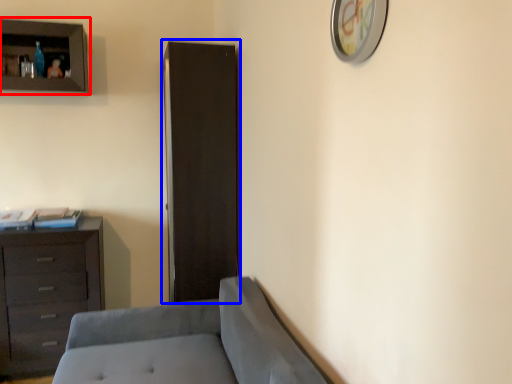
Question: Which of the following is the farthest to the observer, cupboard (highlighted by a red box) or file cabinet (highlighted by a blue box)?

Choices:
 (A) cupboard
 (B) file cabinet

Answer: (A)